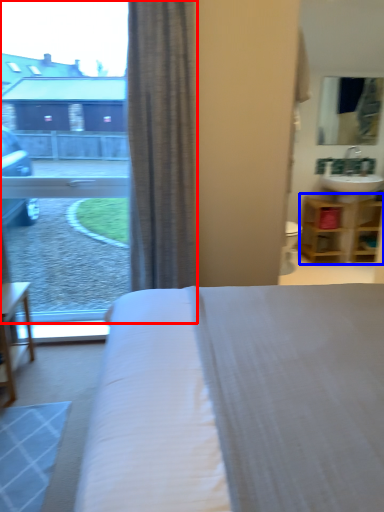
Question: Which point is closer to the camera, window (highlighted by a red box) or shelf (highlighted by a blue box)?

Choices:
 (A) window
 (B) shelf

Answer: (A)